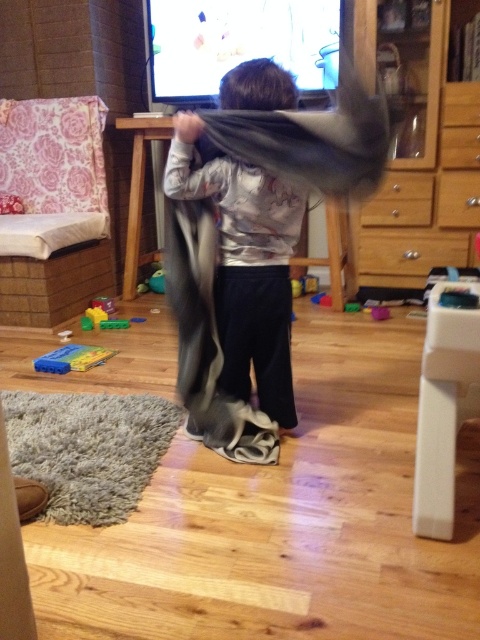
Question: Which point appears closest to the camera in this image?

Choices:
 (A) (41, 362)
 (B) (240, 92)
 (C) (230, 438)

Answer: (B)

Question: Estimate the real-world distances between objects in this image. Which object is closer to the wooden dresser at center?

Choices:
 (A) gray soft blanket at center
 (B) green plastic toy at center
 (C) gray fabric at center

Answer: (C)

Question: Estimate the real-world distances between objects in this image. Which object is closer to the gray soft blanket at center?

Choices:
 (A) wooden dresser at center
 (B) dark brown hair at upper center

Answer: (B)

Question: Can you confirm if gray soft blanket at center is positioned above dark brown hair at upper center?

Choices:
 (A) yes
 (B) no

Answer: (B)

Question: Does yellow plastic toy at lower left come in front of green plastic toy at center?

Choices:
 (A) no
 (B) yes

Answer: (B)

Question: Can you confirm if wooden dresser at center is smaller than gray fabric at center?

Choices:
 (A) yes
 (B) no

Answer: (B)